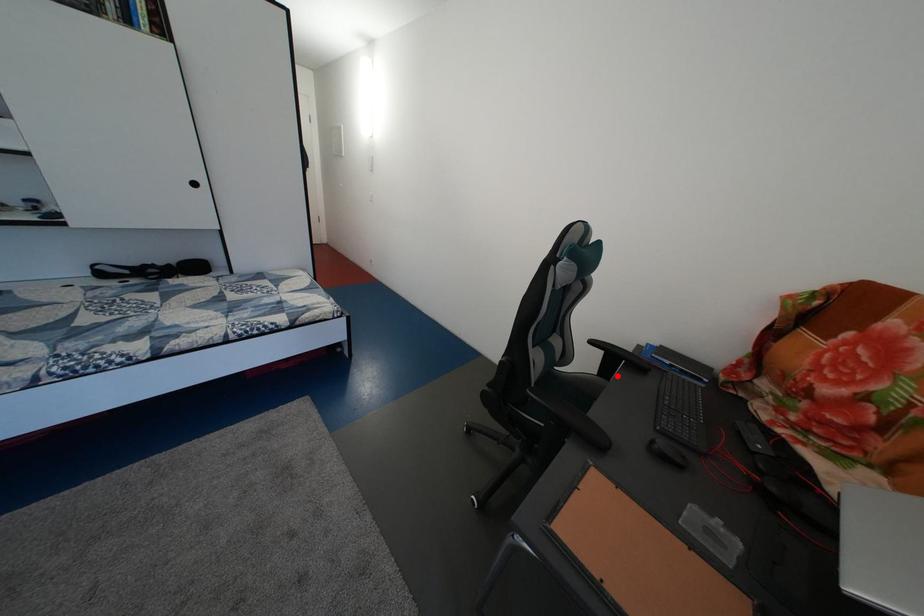
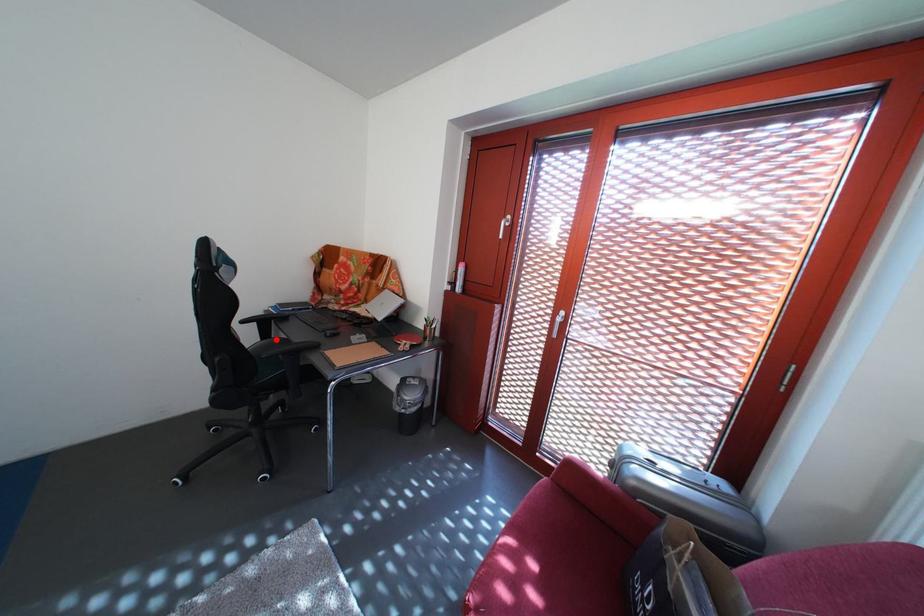
I am providing you with two images of the same scene from different viewpoints. A red point is marked on the first image and another point is marked on the second image. Is the red point in image1 aligned with the point shown in image2?

Yes